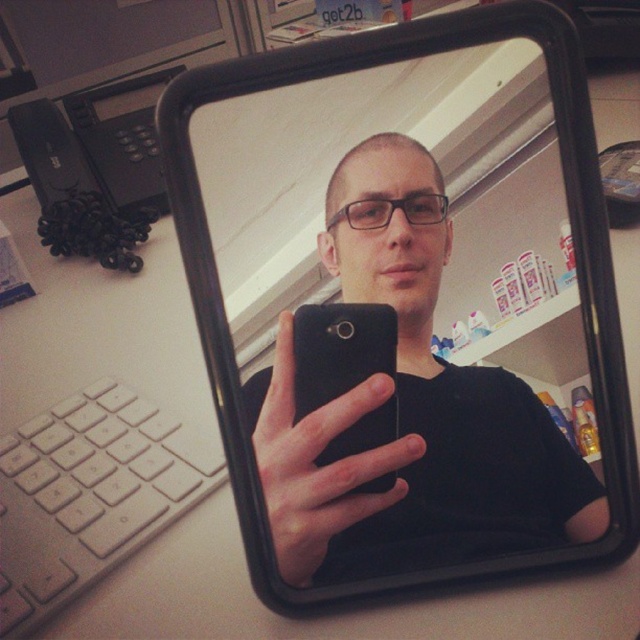
You are holding a black matte smartphone at center and want to take a selfie using the black plastic view mirror at center. Which direction should you move the smartphone to frame yourself better in the mirror?

You should move the black matte smartphone at center to the left to frame yourself better in the black plastic view mirror at center since the mirror is to the right of the smartphone.

You are holding a black matte smartphone at center and want to place it on the desk next to the black plastic view mirror at center. Considering their widths, which one is wider?

The black plastic view mirror at center is wider than the black matte smartphone at center, so the mirror will take up more space on the desk.

You are holding a black matte smartphone at center and want to take a photo of the black plastic view mirror at center. Can you fit the entire mirror in the frame without moving the phone?

The black plastic view mirror at center is taller than the black matte smartphone at center, so the mirror may not fit entirely in the phone camera frame due to its greater height.